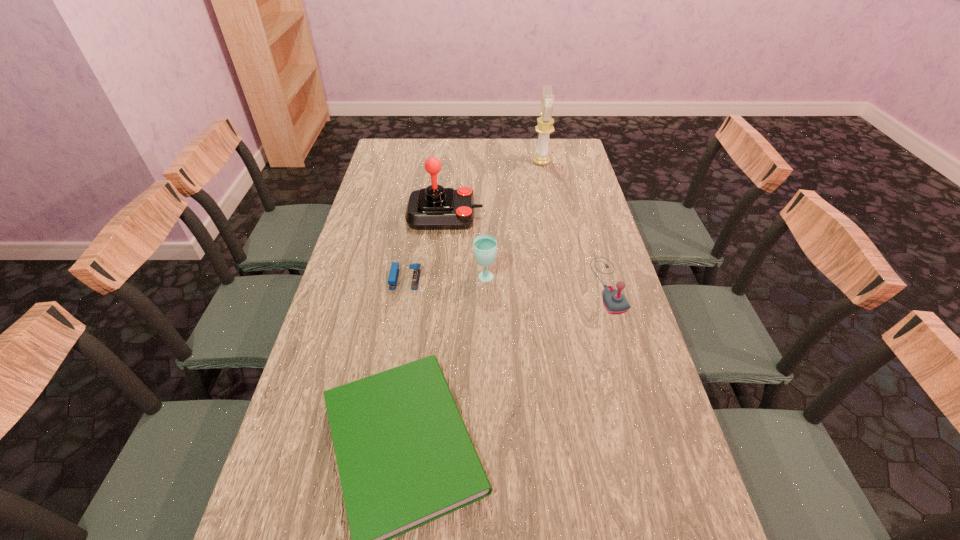
Identify the location of the second object from right to left. This screenshot has width=960, height=540. (545, 123).

You are a GUI agent. You are given a task and a screenshot of the screen. Output one action in this format:
    pyautogui.click(x=<x>, y=<y>)
    Task: Click on the tallest object
    Image resolution: width=960 pixels, height=540 pixels.
    Given the screenshot: What is the action you would take?
    pyautogui.click(x=545, y=123)

The width and height of the screenshot is (960, 540). I want to click on the left joystick, so click(x=433, y=208).

Image resolution: width=960 pixels, height=540 pixels. I want to click on the taller joystick, so click(x=433, y=208).

Find the location of a particular element. The image size is (960, 540). glass is located at coordinates (485, 246).

Locate an element on the screen. Image resolution: width=960 pixels, height=540 pixels. the right joystick is located at coordinates (614, 301).

At what (x,y) coordinates should I click in order to perform the action: click on the nearer joystick. Please return your answer as a coordinate pair (x, y). The width and height of the screenshot is (960, 540). Looking at the image, I should click on (614, 301).

I want to click on stapler, so click(x=394, y=270).

This screenshot has width=960, height=540. In order to click on free space located on the front-facing side of the award in this screenshot , I will do `click(459, 162)`.

Locate an element on the screen. This screenshot has width=960, height=540. vacant area located 0.200m on the front-facing side of the award is located at coordinates tap(485, 162).